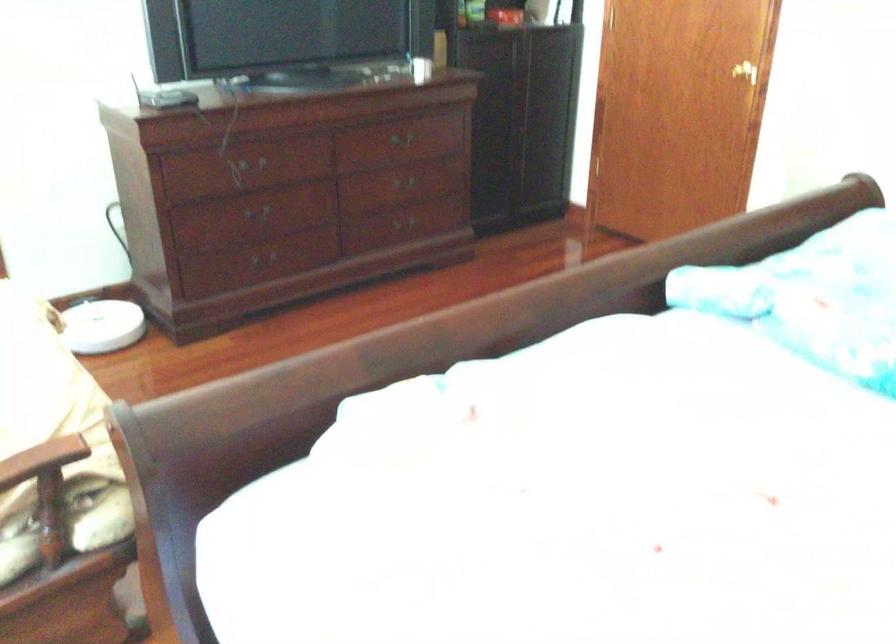
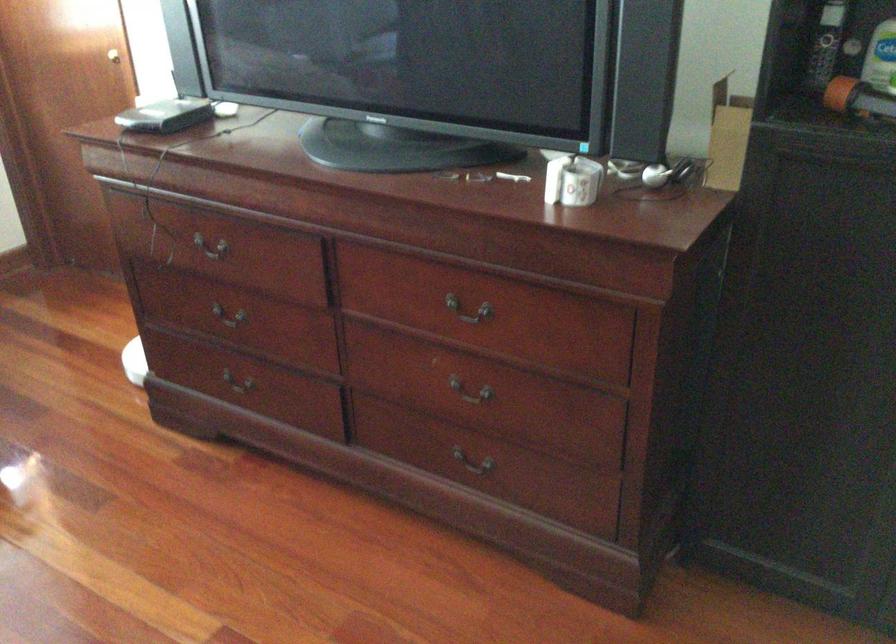
The point at (384, 140) is marked in the first image. Where is the corresponding point in the second image?

(469, 310)